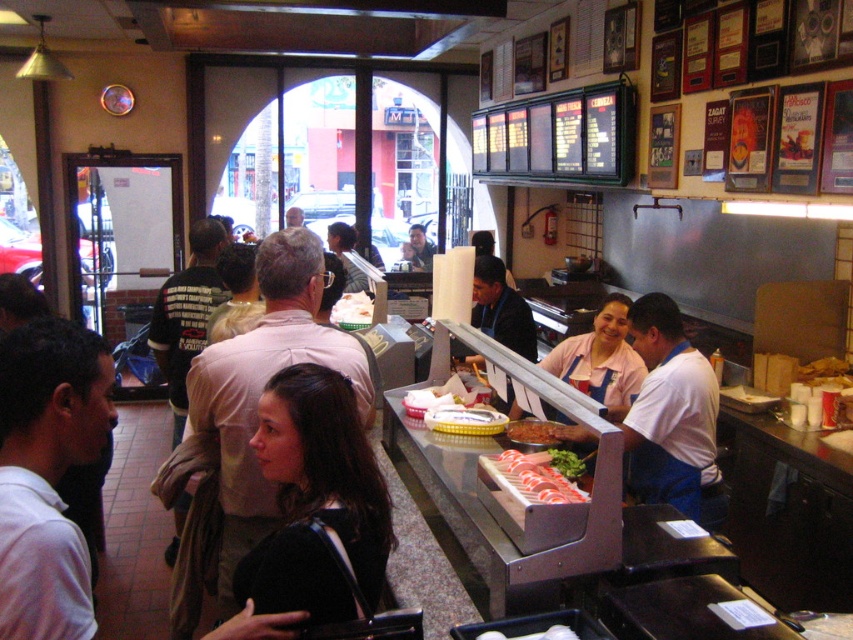
Can you confirm if sliced raw fish at counter is taller than white paper bag at center?

No.

Can you confirm if sliced raw fish at counter is positioned to the left of white paper bag at center?

Incorrect, sliced raw fish at counter is not on the left side of white paper bag at center.

Measure the distance between sliced raw fish at counter and camera.

They are 5.60 feet apart.

You are a GUI agent. You are given a task and a screenshot of the screen. Output one action in this format:
    pyautogui.click(x=<x>, y=<y>)
    Task: Click on the sliced raw fish at counter
    The image size is (853, 640).
    Given the screenshot: What is the action you would take?
    pyautogui.click(x=537, y=477)

Measure the distance between white paper bag at center and camera.

The distance of white paper bag at center from camera is 4.12 meters.

Is white paper bag at center wider than slightly browned bread at counter?

Correct, the width of white paper bag at center exceeds that of slightly browned bread at counter.

Who is more forward, (x=339, y=305) or (x=548, y=440)?

Point (x=548, y=440)

You are a GUI agent. You are given a task and a screenshot of the screen. Output one action in this format:
    pyautogui.click(x=<x>, y=<y>)
    Task: Click on the white paper bag at center
    Image resolution: width=853 pixels, height=640 pixels.
    Given the screenshot: What is the action you would take?
    pyautogui.click(x=352, y=310)

Find the location of a particular element. black fabric shirt at center is located at coordinates [316, 500].

In the scene shown: Does black fabric shirt at center appear over white paper bag at center?

Incorrect, black fabric shirt at center is not positioned above white paper bag at center.

Find the location of a particular element. The image size is (853, 640). black fabric shirt at center is located at coordinates (316, 500).